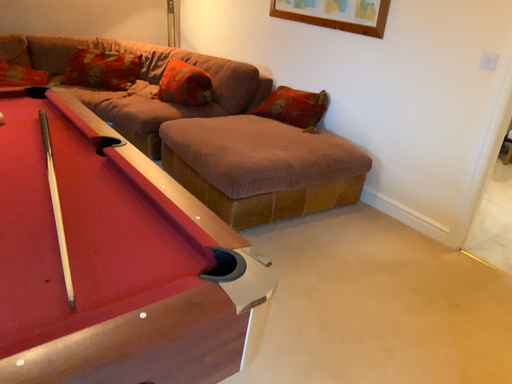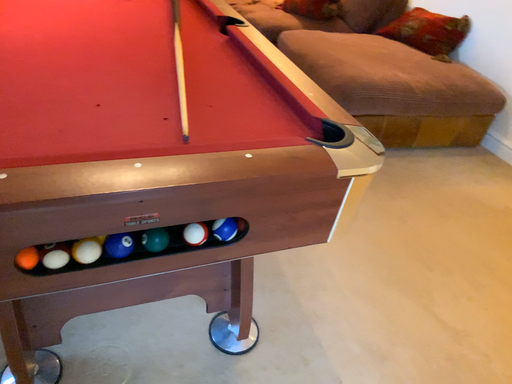
Question: How did the camera likely rotate when shooting the video?

Choices:
 (A) rotated right
 (B) rotated left

Answer: (B)